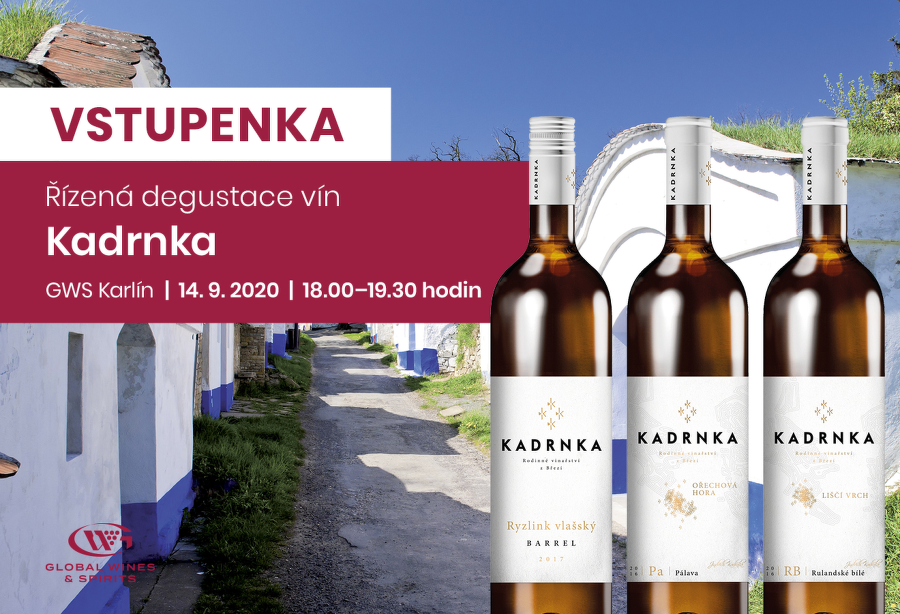
The height and width of the screenshot is (614, 900). Identify the location of doorway. (135, 464), (222, 363), (410, 340).